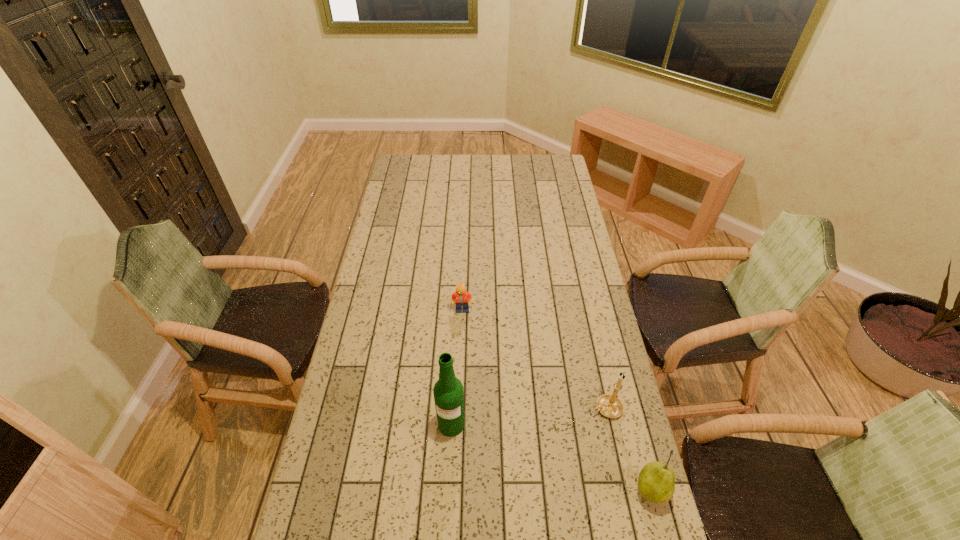
The image size is (960, 540). In order to click on free space on the desktop that is between the tallest object and the pear and is positioned on the handle side of the second tallest object in this screenshot , I will do `click(518, 446)`.

Identify the location of free space on the desktop that is between the beer bottle and the nearest object and is positioned on the front-facing side of the Lego. This screenshot has width=960, height=540. (528, 449).